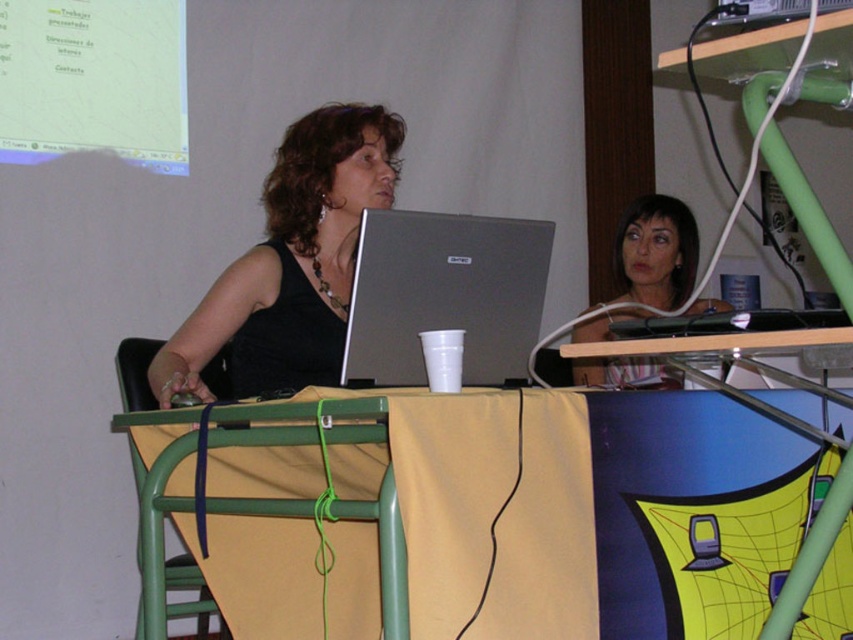
Question: Based on their relative distances, which object is farther from the green plastic chair at lower left?

Choices:
 (A) black matte tank top at center
 (B) silver metallic laptop at upper center
 (C) silver metallic laptop at center

Answer: (B)

Question: Which of the following is the farthest from the observer?

Choices:
 (A) green plastic chair at lower left
 (B) matte black laptop at center

Answer: (A)

Question: Does black matte tank top at center appear under matte black laptop at center?

Choices:
 (A) no
 (B) yes

Answer: (A)

Question: Can you confirm if yellow fabric-covered table at center is thinner than silver metallic laptop at center?

Choices:
 (A) no
 (B) yes

Answer: (A)

Question: Observing the image, what is the correct spatial positioning of black matte tank top at center in reference to green plastic chair at lower left?

Choices:
 (A) below
 (B) above

Answer: (B)

Question: Among these objects, which one is farthest from the camera?

Choices:
 (A) silver metallic laptop at center
 (B) matte black laptop at center
 (C) black matte tank top at center
 (D) yellow fabric-covered table at center

Answer: (B)